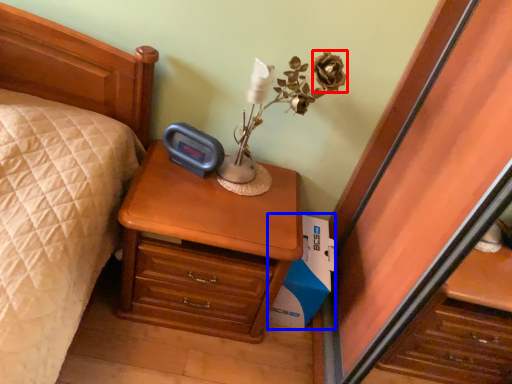
Question: Which point is closer to the camera, flower (highlighted by a red box) or cardboard box (highlighted by a blue box)?

Choices:
 (A) flower
 (B) cardboard box

Answer: (A)